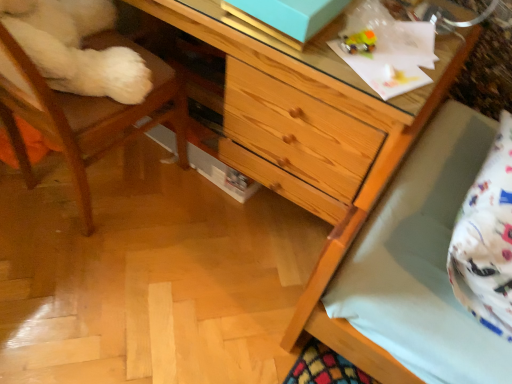
The height and width of the screenshot is (384, 512). Identify the location of wooden chest of drawers at center. (315, 143).

You are a GUI agent. You are given a task and a screenshot of the screen. Output one action in this format:
    pyautogui.click(x=<x>, y=<y>)
    Task: Click on the translucent plastic toy at upper right
    
    Given the screenshot: What is the action you would take?
    pyautogui.click(x=359, y=42)

This screenshot has width=512, height=384. I want to click on wooden chair at left, so click(x=78, y=102).

Is translucent plastic toy at upper right positioned with its back to wooden chest of drawers at center?

Absolutely, translucent plastic toy at upper right is directed away from wooden chest of drawers at center.

Considering the relative positions of translucent plastic toy at upper right and wooden chest of drawers at center in the image provided, is translucent plastic toy at upper right behind wooden chest of drawers at center?

Yes, translucent plastic toy at upper right is further from the camera.

Measure the distance between translucent plastic toy at upper right and wooden chest of drawers at center.

They are 13.27 inches apart.

Considering the relative sizes of translucent plastic toy at upper right and wooden chest of drawers at center in the image provided, is translucent plastic toy at upper right smaller than wooden chest of drawers at center?

Yes, translucent plastic toy at upper right is smaller than wooden chest of drawers at center.

This screenshot has width=512, height=384. Identify the location of chest of drawers to the left of white cotton pillow at lower right. (315, 143).

From the image's perspective, which is above, white cotton pillow at lower right or wooden chest of drawers at center?

From the image's view, wooden chest of drawers at center is above.

Which is more to the left, white cotton pillow at lower right or wooden chest of drawers at center?

wooden chest of drawers at center.

Is white cotton pillow at lower right positioned far away from wooden chest of drawers at center?

They are positioned close to each other.

Which is in front, point (87, 148) or point (348, 46)?

Point (348, 46)

From the image's perspective, between wooden chair at left and translucent plastic toy at upper right, which one is located above?

translucent plastic toy at upper right, from the image's perspective.

Is wooden chair at left facing away from translucent plastic toy at upper right?

No.

From a real-world perspective, is translucent plastic toy at upper right above or below wooden chair at left?

From a real-world perspective, translucent plastic toy at upper right is physically above wooden chair at left.

Considering the sizes of translucent plastic toy at upper right and wooden chair at left in the image, is translucent plastic toy at upper right wider or thinner than wooden chair at left?

Considering their sizes, translucent plastic toy at upper right looks slimmer than wooden chair at left.

Does translucent plastic toy at upper right have a lesser height compared to wooden chair at left?

Correct, translucent plastic toy at upper right is not as tall as wooden chair at left.

Are translucent plastic toy at upper right and wooden chair at left located far from each other?

translucent plastic toy at upper right is actually quite close to wooden chair at left.

Find the location of a particular element. The height and width of the screenshot is (384, 512). pillow to the right of wooden chest of drawers at center is located at coordinates (487, 239).

How distant is wooden chest of drawers at center from white cotton pillow at lower right?

14.56 inches.

Can you tell me how much wooden chest of drawers at center and white cotton pillow at lower right differ in facing direction?

A: wooden chest of drawers at center and white cotton pillow at lower right are facing 3.23 degrees away from each other.

Is wooden chest of drawers at center oriented away from white cotton pillow at lower right?

No, wooden chest of drawers at center is not facing away from white cotton pillow at lower right.

From a real-world perspective, who is located higher, wooden chest of drawers at center or translucent plastic toy at upper right?

From a 3D spatial view, translucent plastic toy at upper right is above.

What's the angular difference between wooden chest of drawers at center and translucent plastic toy at upper right's facing directions?

They differ by 34.2 degrees in their facing directions.

Is wooden chest of drawers at center wider or thinner than translucent plastic toy at upper right?

In the image, wooden chest of drawers at center appears to be wider than translucent plastic toy at upper right.

From the image's perspective, between wooden chest of drawers at center and translucent plastic toy at upper right, which one is located above?

From the image's view, wooden chest of drawers at center is above.

Is white cotton pillow at lower right to the right of translucent plastic toy at upper right from the viewer's perspective?

Yes, white cotton pillow at lower right is to the right of translucent plastic toy at upper right.

From a real-world perspective, who is located lower, white cotton pillow at lower right or translucent plastic toy at upper right?

white cotton pillow at lower right, from a real-world perspective.

Does white cotton pillow at lower right have a smaller size compared to translucent plastic toy at upper right?

Actually, white cotton pillow at lower right might be larger than translucent plastic toy at upper right.

The image size is (512, 384). I want to click on the chest of drawers that appears in front of the translucent plastic toy at upper right, so click(315, 143).

In the image, there is a wooden chest of drawers at center. Where is `pillow below it (from the image's perspective)`? The image size is (512, 384). pillow below it (from the image's perspective) is located at coordinates (487, 239).

Considering their positions, is wooden chest of drawers at center positioned further to translucent plastic toy at upper right than wooden chair at left?

wooden chair at left is positioned further to the anchor translucent plastic toy at upper right.

When comparing their distances from wooden chest of drawers at center, does wooden chair at left or white cotton pillow at lower right seem closer?

Among the two, white cotton pillow at lower right is located nearer to wooden chest of drawers at center.

Looking at the image, which one is located further to translucent plastic toy at upper right, white cotton pillow at lower right or wooden chest of drawers at center?

The object further to translucent plastic toy at upper right is white cotton pillow at lower right.

Which object lies nearer to the anchor point wooden chair at left, translucent plastic toy at upper right or wooden chest of drawers at center?

wooden chest of drawers at center.

Based on their spatial positions, is white cotton pillow at lower right or wooden chest of drawers at center closer to wooden chair at left?

wooden chest of drawers at center lies closer to wooden chair at left than the other object.

Looking at the image, which one is located closer to translucent plastic toy at upper right, wooden chair at left or white cotton pillow at lower right?

Based on the image, white cotton pillow at lower right appears to be nearer to translucent plastic toy at upper right.

In the scene shown: When comparing their distances from wooden chest of drawers at center, does white cotton pillow at lower right or wooden chair at left seem further?

wooden chair at left is further to wooden chest of drawers at center.

When comparing their distances from wooden chest of drawers at center, does translucent plastic toy at upper right or white cotton pillow at lower right seem further?

white cotton pillow at lower right lies further to wooden chest of drawers at center than the other object.

Identify the location of toy between wooden chair at left and white cotton pillow at lower right. (359, 42).

Find the location of `chest of drawers between wooden chair at left and white cotton pillow at lower right`. chest of drawers between wooden chair at left and white cotton pillow at lower right is located at coordinates (315, 143).

Where is `chest of drawers between wooden chair at left and translucent plastic toy at upper right in the horizontal direction`? Image resolution: width=512 pixels, height=384 pixels. chest of drawers between wooden chair at left and translucent plastic toy at upper right in the horizontal direction is located at coordinates (315, 143).

Locate an element on the screen. The width and height of the screenshot is (512, 384). toy situated between wooden chest of drawers at center and white cotton pillow at lower right from left to right is located at coordinates (359, 42).